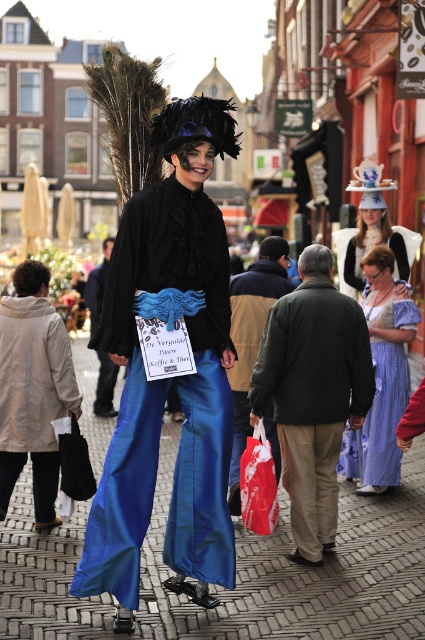
Can you confirm if dark brown leather jacket at center is thinner than red plastic bag at lower center?

No, dark brown leather jacket at center is not thinner than red plastic bag at lower center.

Between point (260, 269) and point (241, 506), which one is positioned in front?

Point (241, 506) is more forward.

Is point (231, 384) behind point (269, 516)?

Yes, point (231, 384) is behind point (269, 516).

Identify the location of dark brown leather jacket at center. (252, 339).

Can you confirm if dark green jacket at center is smaller than blue fabric pants at center?

Correct, dark green jacket at center occupies less space than blue fabric pants at center.

Is dark green jacket at center further to camera compared to blue fabric pants at center?

Yes, dark green jacket at center is further from the viewer.

Which is in front, point (306, 304) or point (110, 368)?

Point (306, 304) is more forward.

The image size is (425, 640). Find the location of `dark green jacket at center`. dark green jacket at center is located at coordinates (312, 394).

Which is behind, point (195, 467) or point (10, 445)?

Positioned behind is point (10, 445).

Measure the distance between matte black shirt at center and camera.

A distance of 8.36 meters exists between matte black shirt at center and camera.

Identify the location of matte black shirt at center. (170, 378).